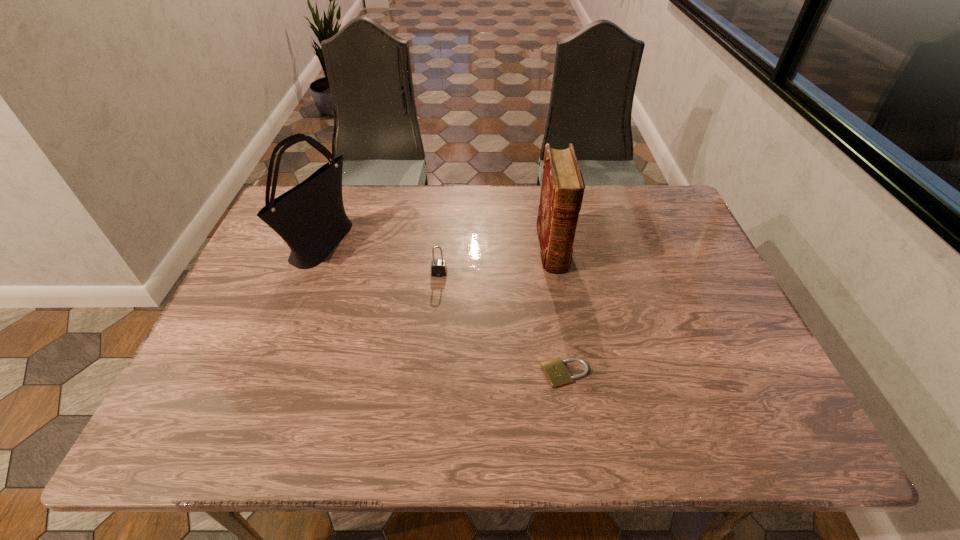
Find the location of a particular element. The image size is (960, 540). vacant area in the image that satisfies the following two spatial constraints: 1. on the shackle of the farther padlock; 2. on the left side of the shortest object is located at coordinates 430,374.

Where is `free space that satisfies the following two spatial constraints: 1. on the shackle of the nearer padlock; 2. on the right side of the second object from left to right`? The image size is (960, 540). free space that satisfies the following two spatial constraints: 1. on the shackle of the nearer padlock; 2. on the right side of the second object from left to right is located at coordinates coord(430,374).

Locate an element on the screen. The height and width of the screenshot is (540, 960). free spot that satisfies the following two spatial constraints: 1. on the shackle of the right padlock; 2. on the right side of the left padlock is located at coordinates (430, 374).